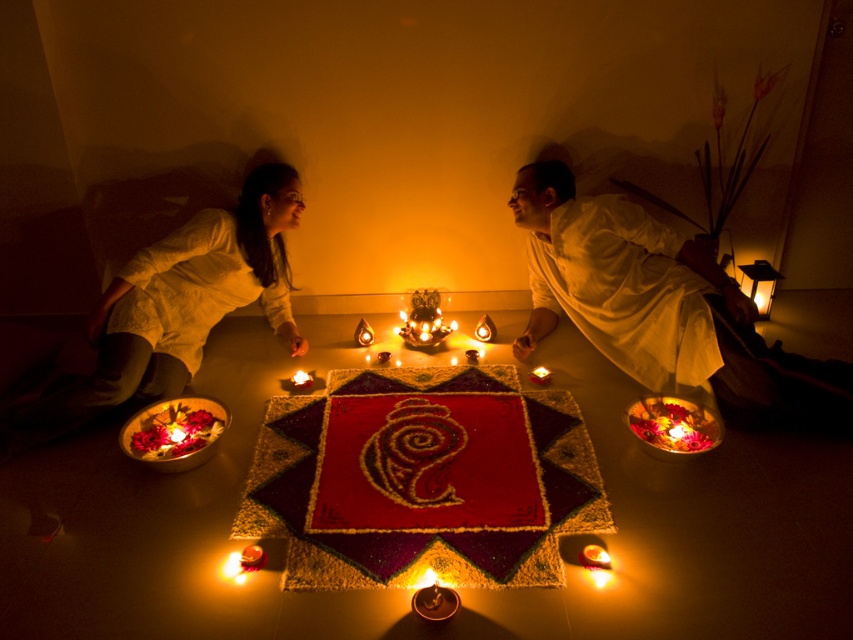
Question: Can you confirm if white cotton robe at left is positioned to the right of matte glass candle at center?

Choices:
 (A) no
 (B) yes

Answer: (A)

Question: Among these objects, which one is nearest to the camera?

Choices:
 (A) matte glass candle at center
 (B) matte black lantern at upper right
 (C) white cotton man at center

Answer: (C)

Question: Which object is positioned farthest from the matte black lantern at upper right?

Choices:
 (A) white cotton man at center
 (B) white cotton robe at left
 (C) matte glass candle at center

Answer: (B)

Question: Which of the following is the farthest from the observer?

Choices:
 (A) (762, 276)
 (B) (297, 371)

Answer: (A)

Question: Does white cotton man at center have a larger size compared to matte glass candle at center?

Choices:
 (A) yes
 (B) no

Answer: (A)

Question: Is the position of white cotton man at center more distant than that of matte black lantern at upper right?

Choices:
 (A) yes
 (B) no

Answer: (B)